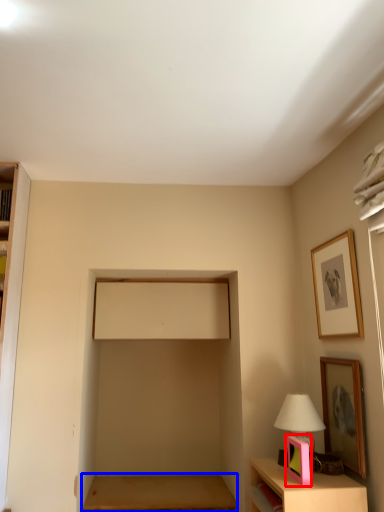
Question: Which of the following is the closest to the observer, picture frame (highlighted by a red box) or table (highlighted by a blue box)?

Choices:
 (A) picture frame
 (B) table

Answer: (A)